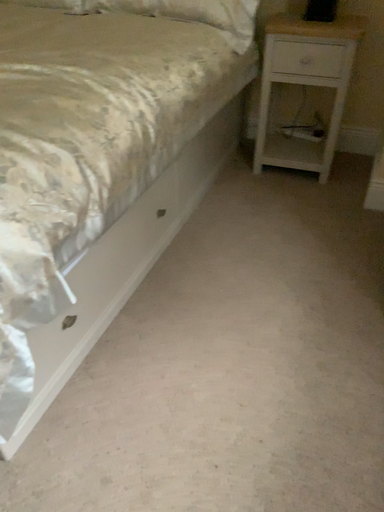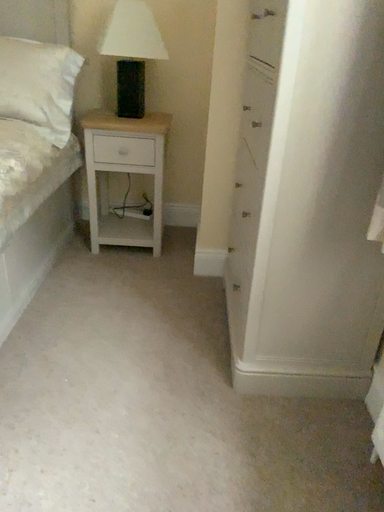
Question: How did the camera likely rotate when shooting the video?

Choices:
 (A) rotated left
 (B) rotated right

Answer: (B)